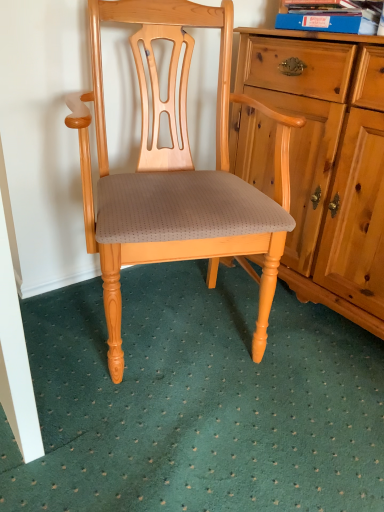
Question: Is blue cardboard book at upper right not within green textured carpet at lower center?

Choices:
 (A) yes
 (B) no

Answer: (A)

Question: Does blue cardboard book at upper right have a lesser width compared to green textured carpet at lower center?

Choices:
 (A) no
 (B) yes

Answer: (B)

Question: Is blue cardboard book at upper right surrounding green textured carpet at lower center?

Choices:
 (A) no
 (B) yes

Answer: (A)

Question: Does blue cardboard book at upper right have a smaller size compared to green textured carpet at lower center?

Choices:
 (A) no
 (B) yes

Answer: (B)

Question: Are blue cardboard book at upper right and green textured carpet at lower center beside each other?

Choices:
 (A) yes
 (B) no

Answer: (B)

Question: Considering the positions of blue cardboard book at upper right and matte wood chair at center in the image, is blue cardboard book at upper right taller or shorter than matte wood chair at center?

Choices:
 (A) short
 (B) tall

Answer: (A)

Question: In terms of width, does blue cardboard book at upper right look wider or thinner when compared to matte wood chair at center?

Choices:
 (A) thin
 (B) wide

Answer: (A)

Question: Is blue cardboard book at upper right in front of or behind matte wood chair at center in the image?

Choices:
 (A) front
 (B) behind

Answer: (B)

Question: Looking at the image, does blue cardboard book at upper right seem bigger or smaller compared to matte wood chair at center?

Choices:
 (A) big
 (B) small

Answer: (B)

Question: Is blue cardboard book at upper right bigger or smaller than green textured carpet at lower center?

Choices:
 (A) big
 (B) small

Answer: (B)

Question: Is blue cardboard book at upper right wider or thinner than green textured carpet at lower center?

Choices:
 (A) wide
 (B) thin

Answer: (B)

Question: In terms of height, does blue cardboard book at upper right look taller or shorter compared to green textured carpet at lower center?

Choices:
 (A) tall
 (B) short

Answer: (A)

Question: From the image's perspective, is blue cardboard book at upper right located above or below green textured carpet at lower center?

Choices:
 (A) below
 (B) above

Answer: (B)

Question: Based on their sizes in the image, would you say green textured carpet at lower center is bigger or smaller than matte wood chair at center?

Choices:
 (A) small
 (B) big

Answer: (A)

Question: Is point (248, 434) positioned closer to the camera than point (84, 136)?

Choices:
 (A) closer
 (B) farther

Answer: (B)